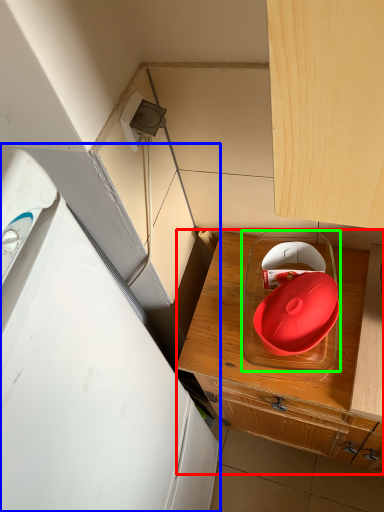
Question: Which object is positioned closest to cabinetry (highlighted by a red box)? Select from home appliance (highlighted by a blue box) and appliance (highlighted by a green box).

Choices:
 (A) home appliance
 (B) appliance

Answer: (B)